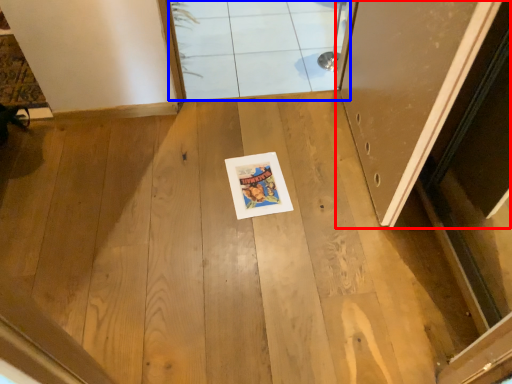
Question: Which point is further to the camera, door (highlighted by a red box) or window (highlighted by a blue box)?

Choices:
 (A) door
 (B) window

Answer: (B)